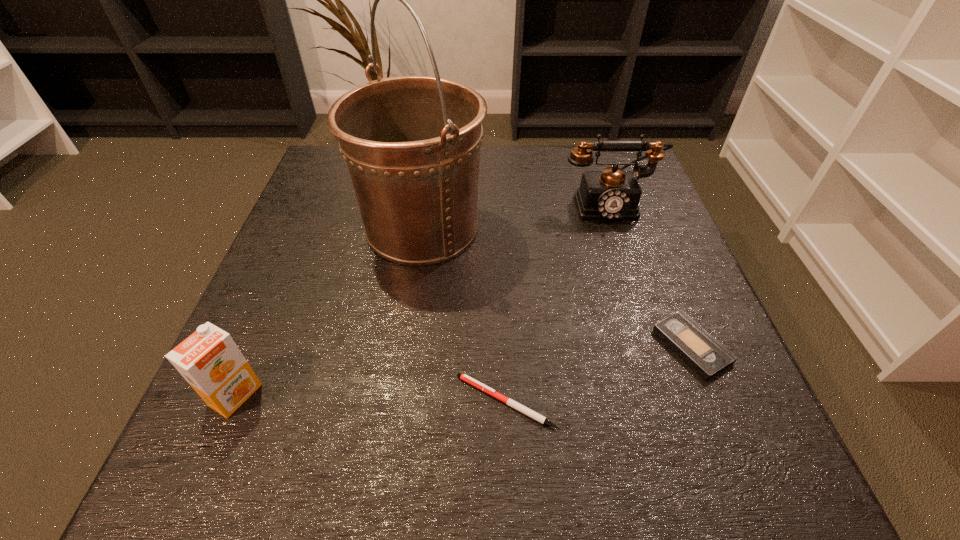
The height and width of the screenshot is (540, 960). In order to click on vacant space located on the clicker of the shortest object in this screenshot , I will do `click(348, 402)`.

Find the location of a particular element. free space located 0.080m on the clicker of the shortest object is located at coordinates (402, 402).

Where is `vacant space located 0.330m on the clicker of the shortest object`? The image size is (960, 540). vacant space located 0.330m on the clicker of the shortest object is located at coordinates (235, 402).

Locate an element on the screen. This screenshot has width=960, height=540. bucket at the far edge is located at coordinates (412, 144).

Find the location of `telephone at the far edge`. telephone at the far edge is located at coordinates (612, 194).

You are a GUI agent. You are given a task and a screenshot of the screen. Output one action in this format:
    pyautogui.click(x=<x>, y=<y>)
    Task: Click on the object present at the near edge
    The width and height of the screenshot is (960, 540).
    Given the screenshot: What is the action you would take?
    pyautogui.click(x=464, y=377)

The width and height of the screenshot is (960, 540). I want to click on bucket that is at the left edge, so click(x=412, y=144).

This screenshot has height=540, width=960. I want to click on orange juice that is positioned at the left edge, so click(209, 360).

Where is `telephone that is at the right edge`? The height and width of the screenshot is (540, 960). telephone that is at the right edge is located at coordinates (612, 194).

Identify the location of videotape that is at the right edge. (706, 355).